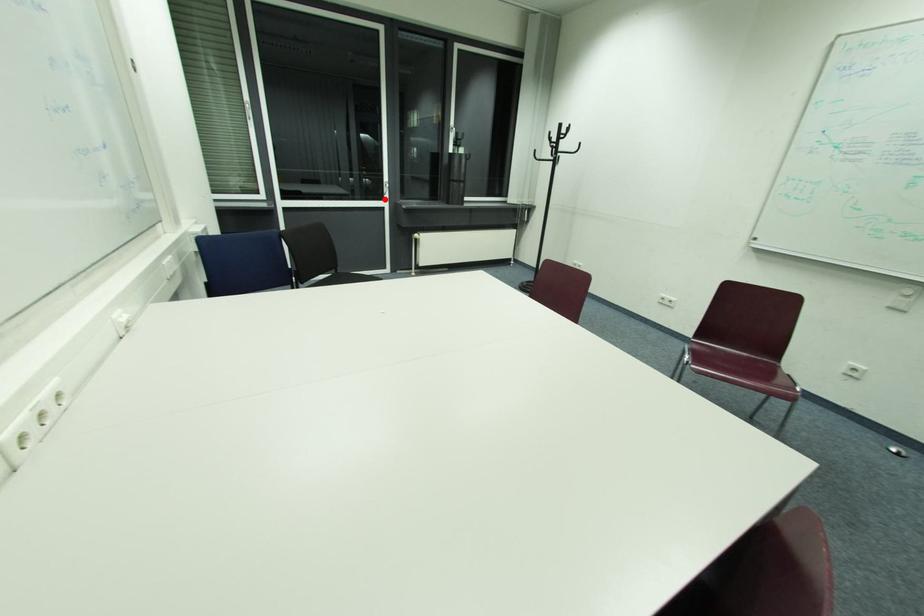
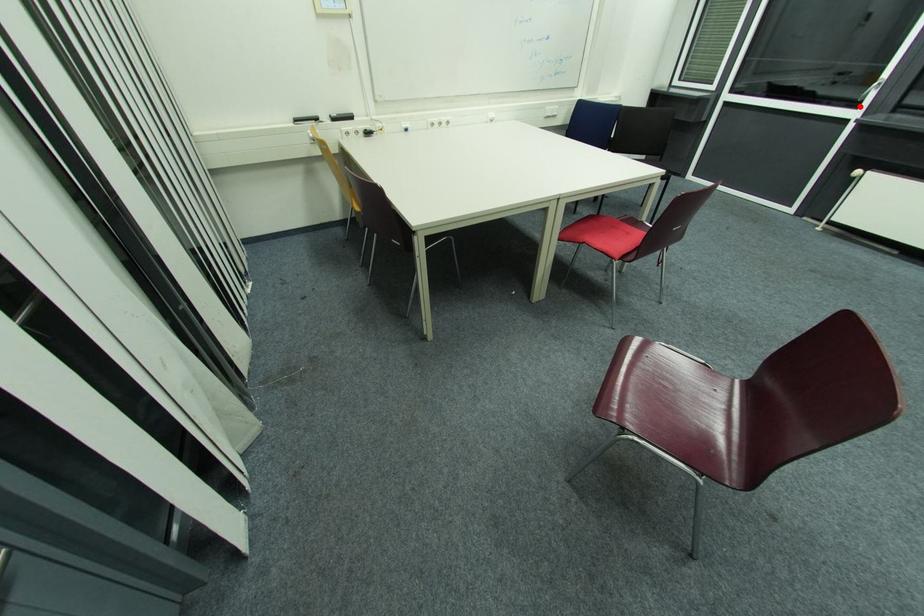
I am providing you with two images of the same scene from different viewpoints. A red point is marked on the first image and another point is marked on the second image. Do the highlighted points in image1 and image2 indicate the same real-world spot?

Yes